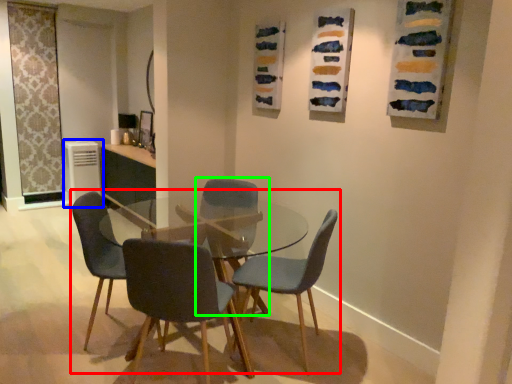
Question: Estimate the real-world distances between objects in this image. Which object is farther from kitchen & dining room table (highlighted by a red box), appliance (highlighted by a blue box) or chair (highlighted by a green box)?

Choices:
 (A) appliance
 (B) chair

Answer: (A)